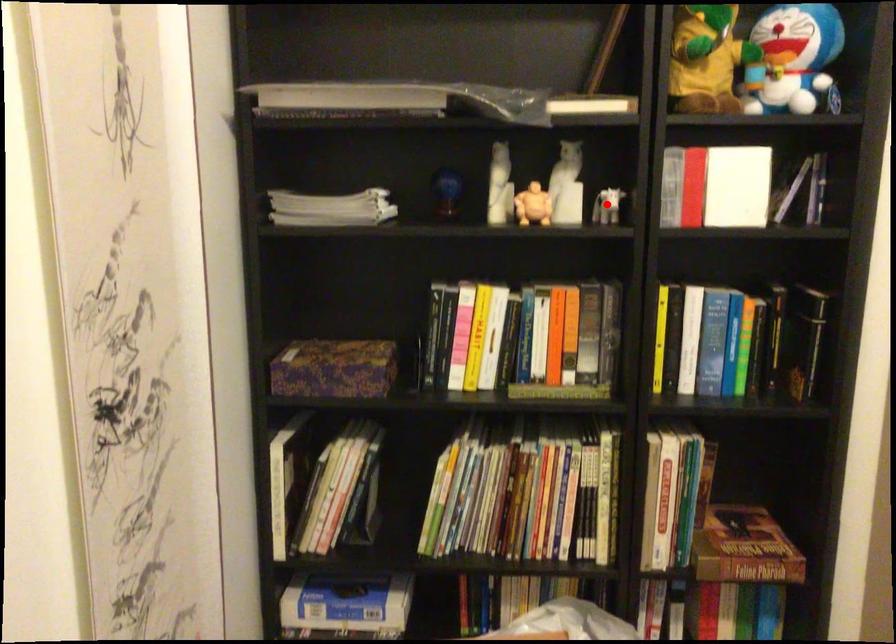
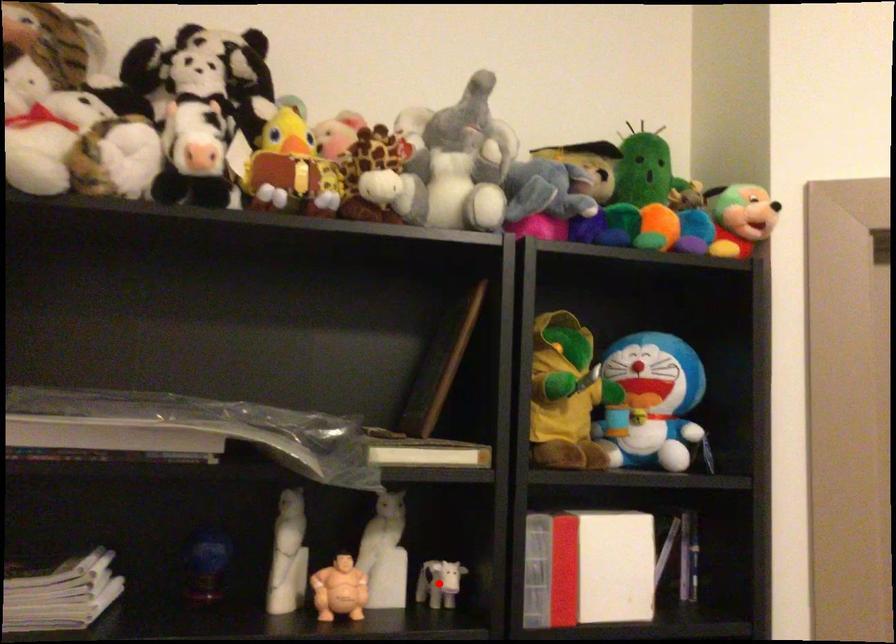
I am providing you with two images of the same scene from different viewpoints. A red point is marked on the first image and another point is marked on the second image. Do the highlighted points in image1 and image2 indicate the same real-world spot?

Yes